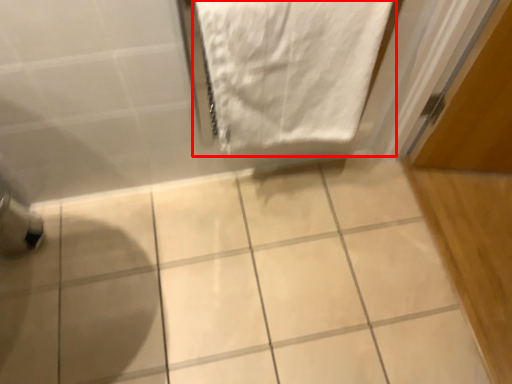
Question: Where is towel (annotated by the red box) located in relation to ceramic tile in the image?

Choices:
 (A) left
 (B) right

Answer: (B)